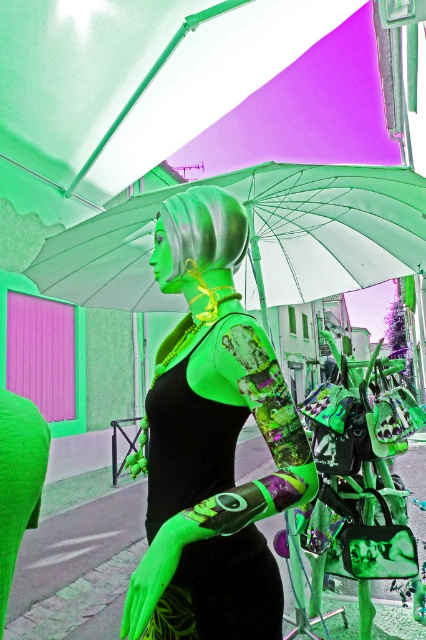
Question: Is green fabric canopy at upper center smaller than green matte sculpture at lower left?

Choices:
 (A) yes
 (B) no

Answer: (B)

Question: Is the position of green fabric canopy at upper center more distant than that of transparent plastic umbrella at center?

Choices:
 (A) yes
 (B) no

Answer: (A)

Question: Among these points, which one is nearest to the camera?

Choices:
 (A) (233, 561)
 (B) (389, 212)
 (C) (0, 609)
 (D) (353, 132)

Answer: (C)

Question: Which point appears farthest from the camera in this image?

Choices:
 (A) (22, 456)
 (B) (135, 209)
 (C) (157, 86)

Answer: (C)

Question: Which is farther from the green fabric canopy at upper center?

Choices:
 (A) transparent plastic umbrella at center
 (B) black matte dress at center

Answer: (B)

Question: Is transparent plastic umbrella at center smaller than green matte sculpture at lower left?

Choices:
 (A) yes
 (B) no

Answer: (B)